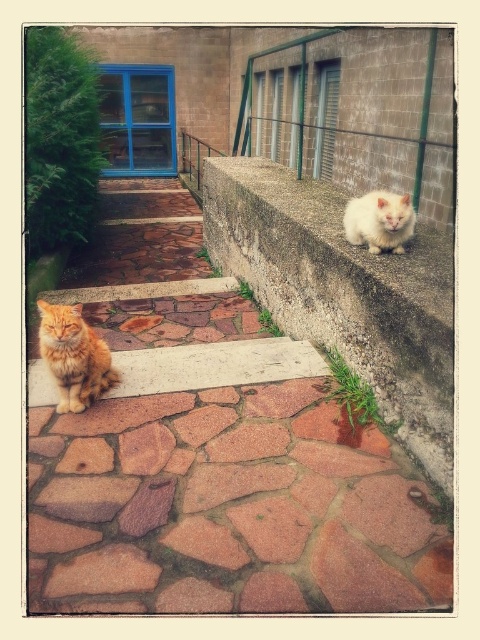
Question: Which point is farther to the camera?

Choices:
 (A) (305, 288)
 (B) (61, 321)
 (C) (262, 573)
 (D) (385, 192)

Answer: (D)

Question: Which object is closer to the camera taking this photo?

Choices:
 (A) stone mosaic steps at center
 (B) orange fur cat at left
 (C) white concrete ledge at upper right
 (D) white fluffy cat at upper right

Answer: (C)

Question: Which object is farther from the camera taking this photo?

Choices:
 (A) stone mosaic steps at center
 (B) orange fur cat at left
 (C) white fluffy cat at upper right

Answer: (A)

Question: Can you confirm if stone mosaic steps at center is smaller than white fluffy cat at upper right?

Choices:
 (A) no
 (B) yes

Answer: (B)

Question: Is white concrete ledge at upper right thinner than orange fur cat at left?

Choices:
 (A) no
 (B) yes

Answer: (A)

Question: Does stone mosaic steps at center have a lesser width compared to white fluffy cat at upper right?

Choices:
 (A) no
 (B) yes

Answer: (A)